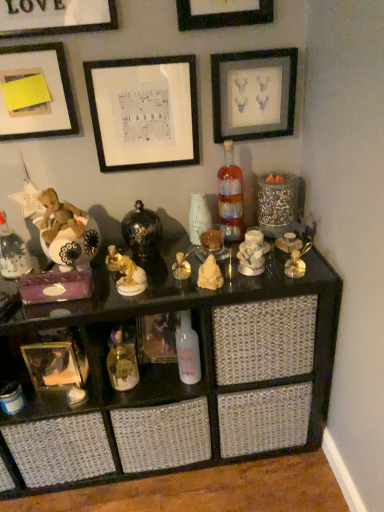
Question: Would you say gold metallic picture frame at lower left, the 1th picture frame ordered from the bottom, is inside or outside gold metallic toy at lower center, the fifth toy positioned from the right?

Choices:
 (A) inside
 (B) outside

Answer: (B)

Question: In terms of height, does gold metallic picture frame at lower left, the 1th picture frame ordered from the bottom, look taller or shorter compared to gold metallic toy at lower center, the fifth toy positioned from the right?

Choices:
 (A) tall
 (B) short

Answer: (B)

Question: Considering the real-world distances, which object is closest to the porcelain figurine at center, which is the 5th toy in left-to-right order?

Choices:
 (A) yellow paper at upper left, acting as the third picture frame starting from the bottom
 (B) black glossy shelf at center
 (C) matte black bottle at left, the first bottle when ordered from left to right
 (D) gold metallic perfume bottle at center, arranged as the third toy when viewed from the left
 (E) gold metallic figurine at center, which appears as the 4th toy when viewed from the right

Answer: (D)

Question: Based on their relative distances, which object is nearer to the white glossy vase at center?

Choices:
 (A) gold metallic picture frame at lower left, marked as the 6th picture frame in a top-to-bottom arrangement
 (B) porcelain figurine at center, which is the 5th toy in left-to-right order
 (C) black matte picture frame at upper center, the first picture frame viewed from the top
 (D) white glossy bottle at center, arranged as the second bottle when viewed from the right
 (E) yellow paper at upper left, acting as the third picture frame starting from the bottom

Answer: (B)